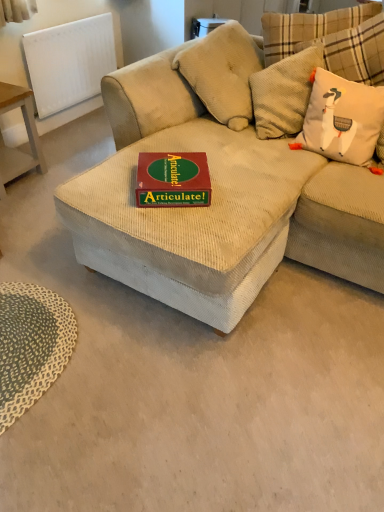
Identify the location of free space above green matte board game at center (from a real-world perspective). (172, 168).